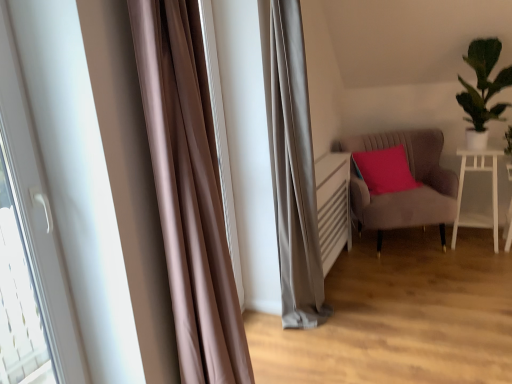
The width and height of the screenshot is (512, 384). In order to click on free space between white glossy table at right and satin brown curtain at left in this screenshot , I will do `click(376, 294)`.